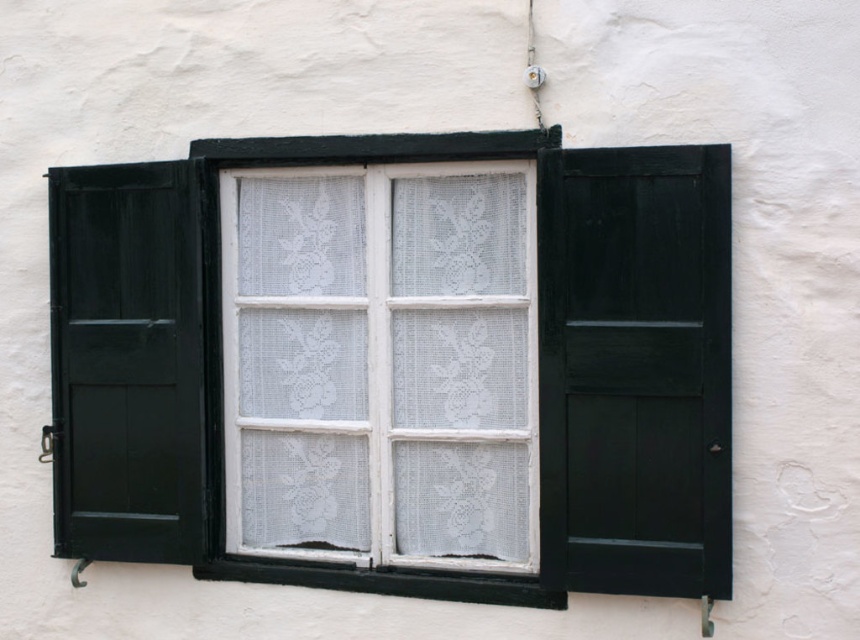
You are an architect designing a new building. You want to install a window and shutter combination similar to the one shown. Given that the white painted wood window frame at center must be larger than the matte black shutter at right, which object should you prioritize in terms of size when planning the design?

The white painted wood window frame at center should be prioritized to be larger than the matte black shutter at right as per the design requirement.

You are standing in front of a building and see the white painted wood window frame at center and the matte black shutter at left. Which object is positioned to the right of the other?

The white painted wood window frame at center is to the right of matte black shutter at left.

You are an architect designing a new building and want to ensure that the window and shutters match in proportions. Given that the white painted wood window frame at center and the matte black shutter at left are part of the same design, which one is taller?

The white painted wood window frame at center is much taller than the matte black shutter at left, so the window frame is taller in the design.